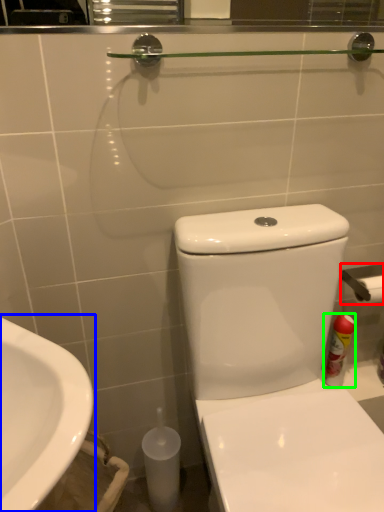
Question: Considering the real-world distances, which object is farthest from towel bar (highlighted by a red box)? sink (highlighted by a blue box) or cleaning product (highlighted by a green box)?

Choices:
 (A) sink
 (B) cleaning product

Answer: (A)